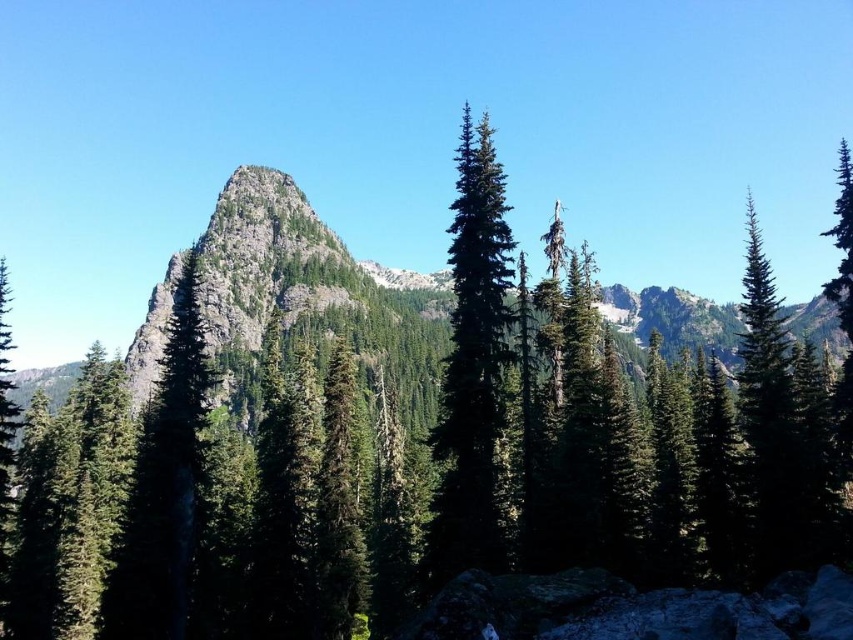
Question: Is green matte tree at left further to the viewer compared to green textured tree at right?

Choices:
 (A) no
 (B) yes

Answer: (A)

Question: Does green matte tree at left have a larger size compared to green textured tree at right?

Choices:
 (A) yes
 (B) no

Answer: (B)

Question: Is green matte tree at left below green textured tree at right?

Choices:
 (A) no
 (B) yes

Answer: (B)

Question: Which of the following is the closest to the observer?

Choices:
 (A) green matte tree at center
 (B) green matte tree at left

Answer: (A)

Question: Among these points, which one is farthest from the camera?

Choices:
 (A) (845, 179)
 (B) (460, 381)
 (C) (120, 600)

Answer: (A)

Question: Which of the following is the farthest from the observer?

Choices:
 (A) green textured tree at right
 (B) green matte tree at center

Answer: (A)